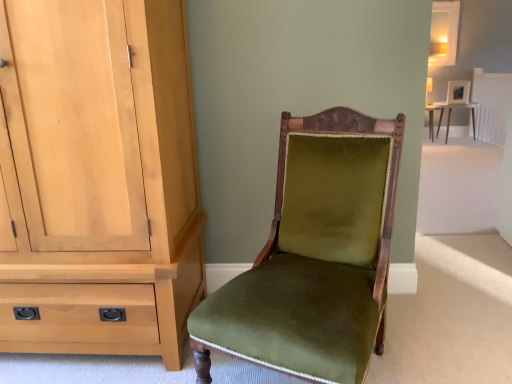
Locate an element on the screen. unoccupied region to the right of velvet-green chair at center is located at coordinates (442, 333).